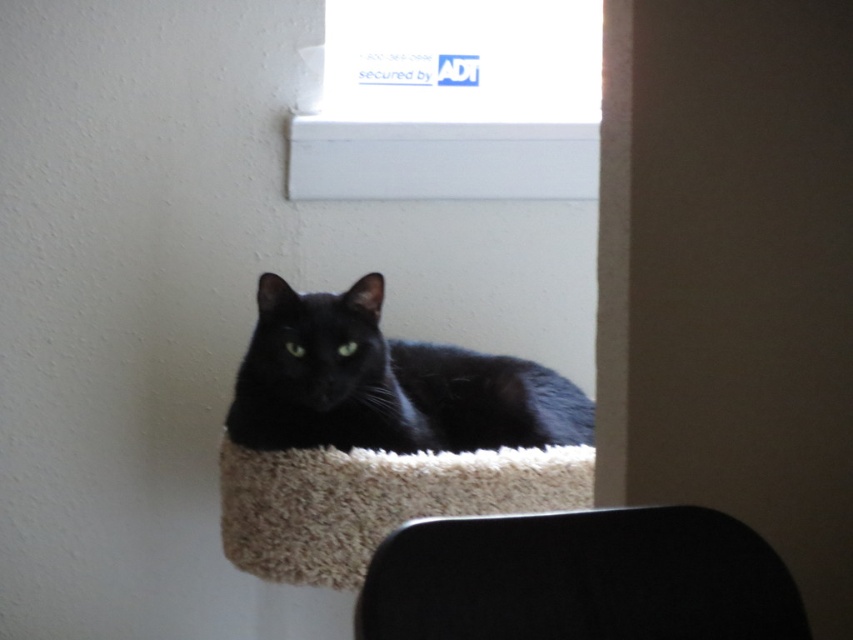
Can you confirm if white plastic window sill at upper center is wider than white smooth window sill at upper center?

Indeed, white plastic window sill at upper center has a greater width compared to white smooth window sill at upper center.

Is white plastic window sill at upper center to the left of white smooth window sill at upper center from the viewer's perspective?

Incorrect, white plastic window sill at upper center is not on the left side of white smooth window sill at upper center.

This screenshot has height=640, width=853. Describe the element at coordinates (453, 100) in the screenshot. I see `white plastic window sill at upper center` at that location.

At what (x,y) coordinates should I click in order to perform the action: click on white plastic window sill at upper center. Please return your answer as a coordinate pair (x, y). The image size is (853, 640). Looking at the image, I should click on (453, 100).

Is point (445, 10) positioned after point (294, 516)?

Yes.

Who is taller, white plastic window sill at upper center or beige fluffy cat bed at center?

With more height is white plastic window sill at upper center.

Which is in front, point (424, 72) or point (337, 500)?

Point (337, 500)

Find the location of a particular element. This screenshot has width=853, height=640. white plastic window sill at upper center is located at coordinates (453, 100).

Who is lower down, smooth black chair at lower center or matte black cat at center?

smooth black chair at lower center is below.

Who is taller, smooth black chair at lower center or matte black cat at center?

matte black cat at center is taller.

Identify the location of smooth black chair at lower center. The height and width of the screenshot is (640, 853). (579, 579).

This screenshot has width=853, height=640. What are the coordinates of `smooth black chair at lower center` in the screenshot? It's located at (579, 579).